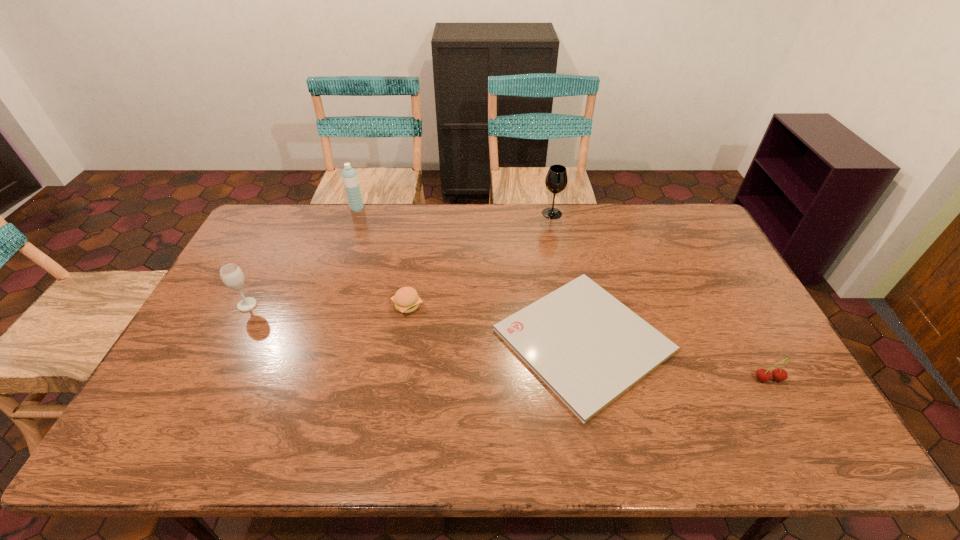
The image size is (960, 540). Identify the location of free space located on the right of the second object from left to right. click(377, 209).

The image size is (960, 540). In order to click on free point located 0.360m on the left of the taller wineglass in this screenshot , I will do `click(445, 213)`.

Image resolution: width=960 pixels, height=540 pixels. Find the location of `free location located on the front of the nearer wineglass`. free location located on the front of the nearer wineglass is located at coordinates (228, 342).

What are the coordinates of `blank space located on the surface of the rightmost object` in the screenshot? It's located at (787, 414).

Where is `free point located on the right of the second shortest object`? The width and height of the screenshot is (960, 540). free point located on the right of the second shortest object is located at coordinates (528, 306).

Image resolution: width=960 pixels, height=540 pixels. I want to click on free space located 0.200m on the back of the shortest object, so click(x=562, y=238).

Identify the location of water bottle positioned at the far edge. The height and width of the screenshot is (540, 960). (349, 175).

The width and height of the screenshot is (960, 540). In order to click on wineglass at the far edge in this screenshot , I will do `click(556, 179)`.

Identify the location of object present at the near edge. (585, 345).

Find the location of `object at the left edge`. object at the left edge is located at coordinates (x=232, y=276).